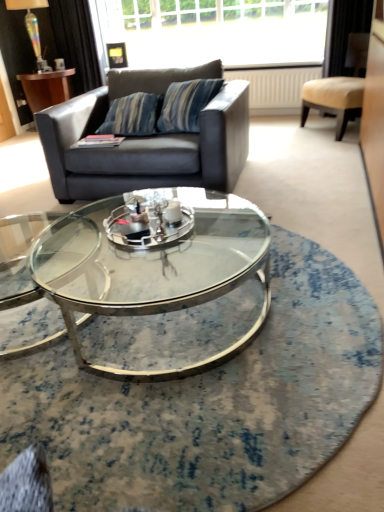
You are a GUI agent. You are given a task and a screenshot of the screen. Output one action in this format:
    pyautogui.click(x=<x>, y=<y>)
    Task: Click on the beige leather chair at upper right
    This screenshot has height=512, width=384.
    Given the screenshot: What is the action you would take?
    pyautogui.click(x=339, y=88)

Measure the distance between iridescent glass lamp at upper left and camera.

A distance of 4.74 meters exists between iridescent glass lamp at upper left and camera.

The height and width of the screenshot is (512, 384). What do you see at coordinates (214, 32) in the screenshot?
I see `clear glass window at upper center` at bounding box center [214, 32].

Describe the element at coordinates (46, 88) in the screenshot. I see `brushed metal side table at upper left` at that location.

You are a GUI agent. You are given a task and a screenshot of the screen. Output one action in this format:
    pyautogui.click(x=<x>, y=<y>)
    Task: Click on the clear glass coffee table at center
    Image resolution: width=384 pixels, height=512 pixels.
    Given the screenshot: What is the action you would take?
    pyautogui.click(x=159, y=284)

Locate an element on the screen. The width and height of the screenshot is (384, 512). studio couch behind the clear glass coffee table at center is located at coordinates (146, 140).

What's the angular difference between dark gray fabric couch at upper left and clear glass coffee table at center's facing directions?

dark gray fabric couch at upper left and clear glass coffee table at center are facing 90.9 degrees away from each other.

Is dark gray fabric couch at upper left closer to camera compared to clear glass coffee table at center?

No, dark gray fabric couch at upper left is further to the viewer.

From the image's perspective, is dark gray fabric couch at upper left located above or below clear glass coffee table at center?

dark gray fabric couch at upper left is above clear glass coffee table at center.

Is iridescent glass lamp at upper left not within clear glass coffee table at center?

iridescent glass lamp at upper left is positioned outside clear glass coffee table at center.

Considering the positions of point (35, 17) and point (253, 265), is point (35, 17) closer or farther from the camera than point (253, 265)?

Point (35, 17) is farther from the camera than point (253, 265).

Does iridescent glass lamp at upper left have a greater height compared to clear glass coffee table at center?

Indeed, iridescent glass lamp at upper left has a greater height compared to clear glass coffee table at center.

Are clear glass window at upper center and iridescent glass lamp at upper left located far from each other?

Absolutely, clear glass window at upper center is distant from iridescent glass lamp at upper left.

Is clear glass window at upper center shorter than iridescent glass lamp at upper left?

In fact, clear glass window at upper center may be taller than iridescent glass lamp at upper left.

Where is `window located underneath the iridescent glass lamp at upper left (from a real-world perspective)`? This screenshot has width=384, height=512. window located underneath the iridescent glass lamp at upper left (from a real-world perspective) is located at coordinates (214, 32).

Is point (127, 0) less distant than point (7, 6)?

That is False.

Is clear glass window at upper center outside of dark gray fabric couch at upper left?

Indeed, clear glass window at upper center is completely outside dark gray fabric couch at upper left.

Who is shorter, clear glass window at upper center or dark gray fabric couch at upper left?

clear glass window at upper center.

Which is closer, (179, 24) or (149, 151)?

Point (179, 24) is farther from the camera than point (149, 151).

Who is shorter, dark gray fabric couch at upper left or black velvet curtain at upper left?

dark gray fabric couch at upper left.

Considering the positions of objects dark gray fabric couch at upper left and black velvet curtain at upper left in the image provided, who is more to the right, dark gray fabric couch at upper left or black velvet curtain at upper left?

Positioned to the right is dark gray fabric couch at upper left.

Is point (245, 94) positioned before point (80, 88)?

Yes, it is in front of point (80, 88).

Is point (77, 52) closer to camera compared to point (44, 76)?

No, it is behind (44, 76).

Does black velvet curtain at upper left have a smaller size compared to brushed metal side table at upper left?

Yes.

Can you confirm if black velvet curtain at upper left is positioned to the right of brushed metal side table at upper left?

Indeed, black velvet curtain at upper left is positioned on the right side of brushed metal side table at upper left.

In the image, there is a black velvet curtain at upper left. Where is `side table below it (from a real-world perspective)`? The width and height of the screenshot is (384, 512). side table below it (from a real-world perspective) is located at coordinates (46, 88).

Considering the relative positions of beige leather chair at upper right and iridescent glass lamp at upper left in the image provided, is beige leather chair at upper right to the right of iridescent glass lamp at upper left from the viewer's perspective?

Yes, beige leather chair at upper right is to the right of iridescent glass lamp at upper left.

From a real-world perspective, is beige leather chair at upper right located higher than iridescent glass lamp at upper left?

Incorrect, from a real-world perspective, beige leather chair at upper right is lower than iridescent glass lamp at upper left.

Between beige leather chair at upper right and iridescent glass lamp at upper left, which one is positioned in front?

beige leather chair at upper right is more forward.

Is beige leather chair at upper right far from iridescent glass lamp at upper left?

That's right, there is a large distance between beige leather chair at upper right and iridescent glass lamp at upper left.

Image resolution: width=384 pixels, height=512 pixels. Identify the location of studio couch located on the right of clear glass coffee table at center. (146, 140).

Locate an element on the screen. The height and width of the screenshot is (512, 384). lamp above the clear glass coffee table at center (from a real-world perspective) is located at coordinates (32, 27).

From the image, which object appears to be nearer to beige leather chair at upper right, brushed metal side table at upper left or clear glass window at upper center?

Based on the image, clear glass window at upper center appears to be nearer to beige leather chair at upper right.

Which object lies nearer to the anchor point dark gray fabric couch at upper left, clear glass window at upper center or iridescent glass lamp at upper left?

clear glass window at upper center.

Looking at the image, which one is located closer to dark gray fabric couch at upper left, beige leather chair at upper right or black velvet curtain at upper left?

beige leather chair at upper right is positioned closer to the anchor dark gray fabric couch at upper left.

Consider the image. Based on their spatial positions, is black velvet curtain at upper left or brushed metal side table at upper left further from clear glass coffee table at center?

The object further to clear glass coffee table at center is black velvet curtain at upper left.

Which object lies further to the anchor point brushed metal side table at upper left, clear glass window at upper center or clear glass coffee table at center?

clear glass coffee table at center is positioned further to the anchor brushed metal side table at upper left.

Which object lies further to the anchor point clear glass window at upper center, black velvet curtain at upper left or beige leather chair at upper right?

beige leather chair at upper right.

From the image, which object appears to be farther from black velvet curtain at upper left, beige leather chair at upper right or iridescent glass lamp at upper left?

beige leather chair at upper right.

Considering their positions, is clear glass window at upper center positioned further to brushed metal side table at upper left than beige leather chair at upper right?

beige leather chair at upper right is further to brushed metal side table at upper left.

I want to click on lamp between clear glass coffee table at center and brushed metal side table at upper left in the front-back direction, so click(32, 27).

Find the location of a particular element. chair between clear glass coffee table at center and clear glass window at upper center along the z-axis is located at coordinates (339, 88).

Find the location of a particular element. window between dark gray fabric couch at upper left and beige leather chair at upper right from left to right is located at coordinates (214, 32).

Where is `window between dark gray fabric couch at upper left and black velvet curtain at upper left in the front-back direction`? window between dark gray fabric couch at upper left and black velvet curtain at upper left in the front-back direction is located at coordinates (214, 32).